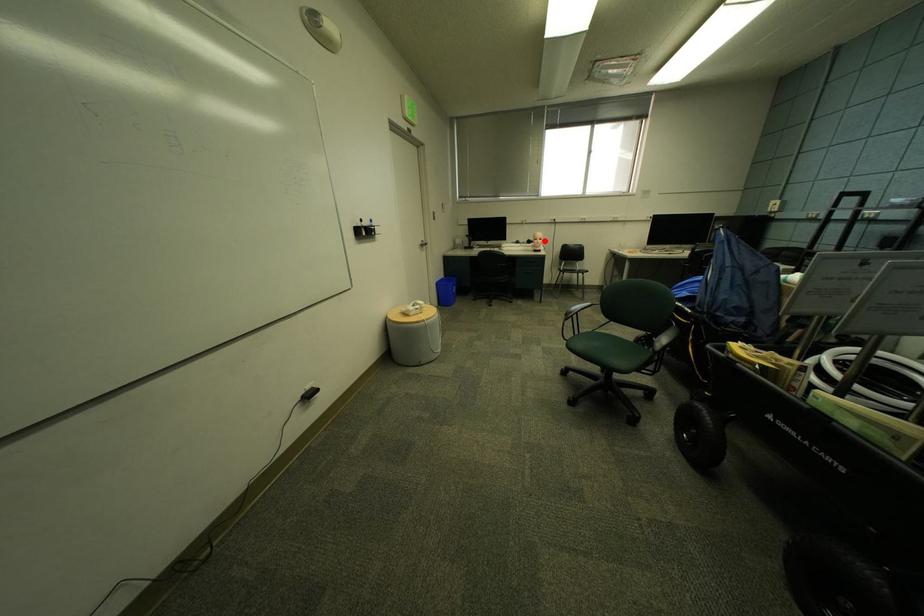
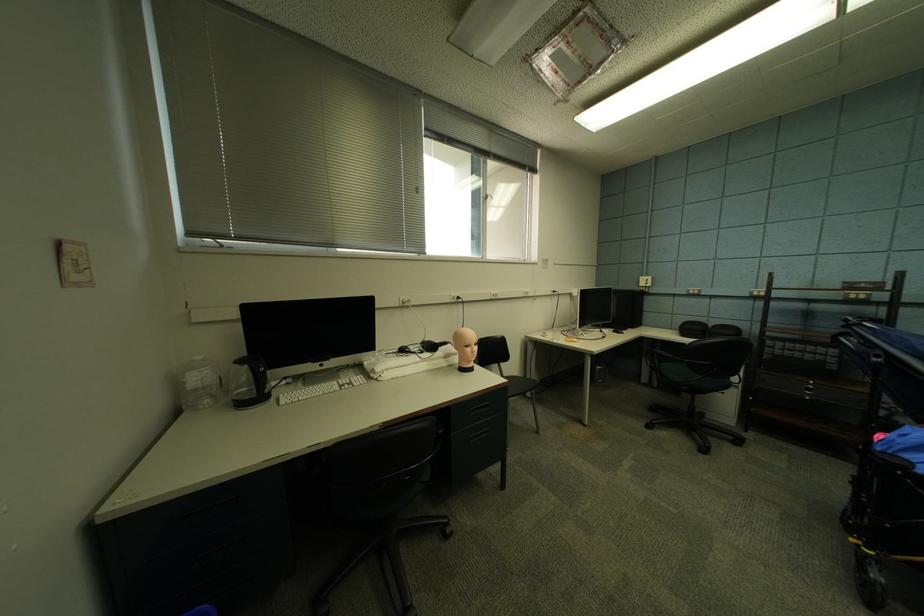
Question: I am providing you with two images of the same scene from different viewpoints. Image1 has a red point marked. In image2, the corresponding 3D location appears at what relative position? Reply with the corresponding letter.

Choices:
 (A) Closer
 (B) Farther

Answer: (B)